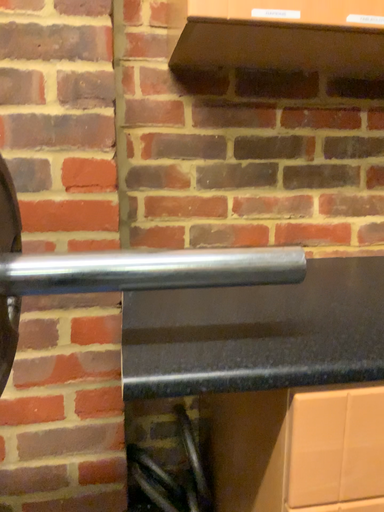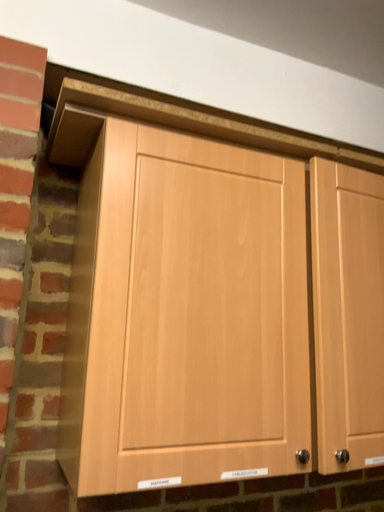
Question: Which way did the camera rotate in the video?

Choices:
 (A) rotated right
 (B) rotated left

Answer: (A)